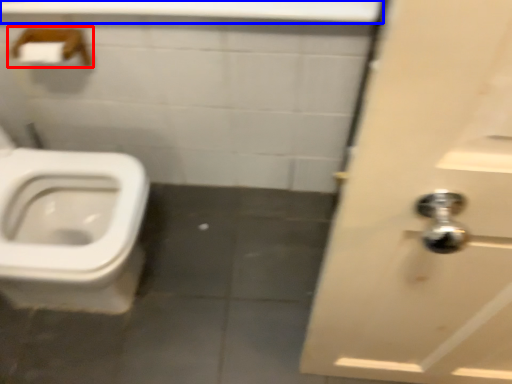
Question: Which of the following is the farthest to the observer, towel bar (highlighted by a red box) or counter top (highlighted by a blue box)?

Choices:
 (A) towel bar
 (B) counter top

Answer: (A)